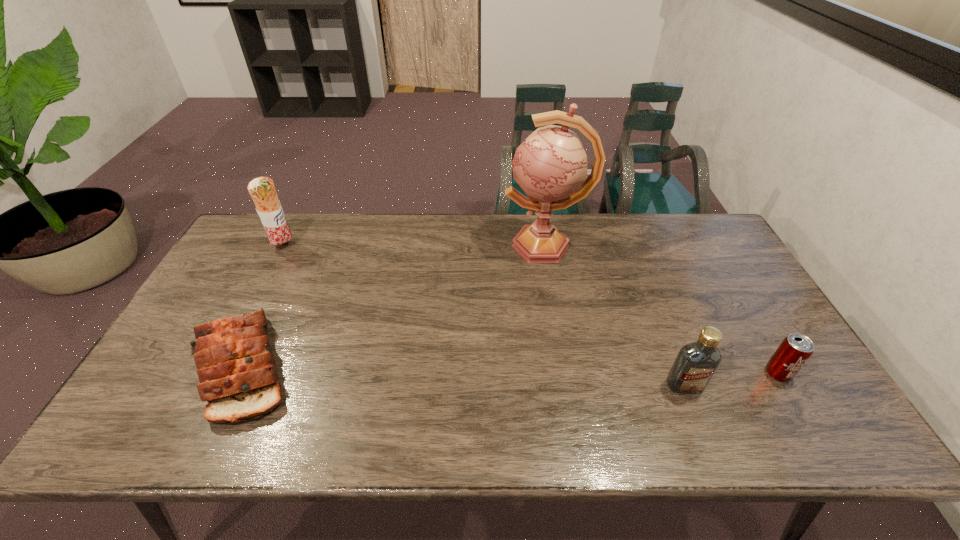
Find the location of `free spot between the third object from right to left and the fourth object from left to right`. free spot between the third object from right to left and the fourth object from left to right is located at coordinates (614, 315).

The width and height of the screenshot is (960, 540). Find the location of `free space that is in between the beer can and the fourth shortest object`. free space that is in between the beer can and the fourth shortest object is located at coordinates (531, 310).

This screenshot has height=540, width=960. What are the coordinates of `unoccupied position between the globe and the bread` in the screenshot? It's located at (394, 306).

In order to click on free area in between the bread and the second object from right to left in this screenshot , I will do `click(464, 376)`.

Find the location of `vacant region between the fourth shortest object and the beer can`. vacant region between the fourth shortest object and the beer can is located at coordinates (531, 310).

Locate an element on the screen. This screenshot has width=960, height=540. vacant point located between the bread and the fourth shortest object is located at coordinates (264, 306).

Where is `unoccupied position between the third object from right to left and the bread`? unoccupied position between the third object from right to left and the bread is located at coordinates [394, 306].

What are the coordinates of `object identified as the third closest to the second tallest object` in the screenshot? It's located at (695, 364).

Locate an element on the screen. object that stands as the third closest to the vodka is located at coordinates (236, 367).

The image size is (960, 540). Find the location of `free location that satisfies the following two spatial constraints: 1. on the front-facing side of the globe; 2. on the back side of the beer can`. free location that satisfies the following two spatial constraints: 1. on the front-facing side of the globe; 2. on the back side of the beer can is located at coordinates (566, 373).